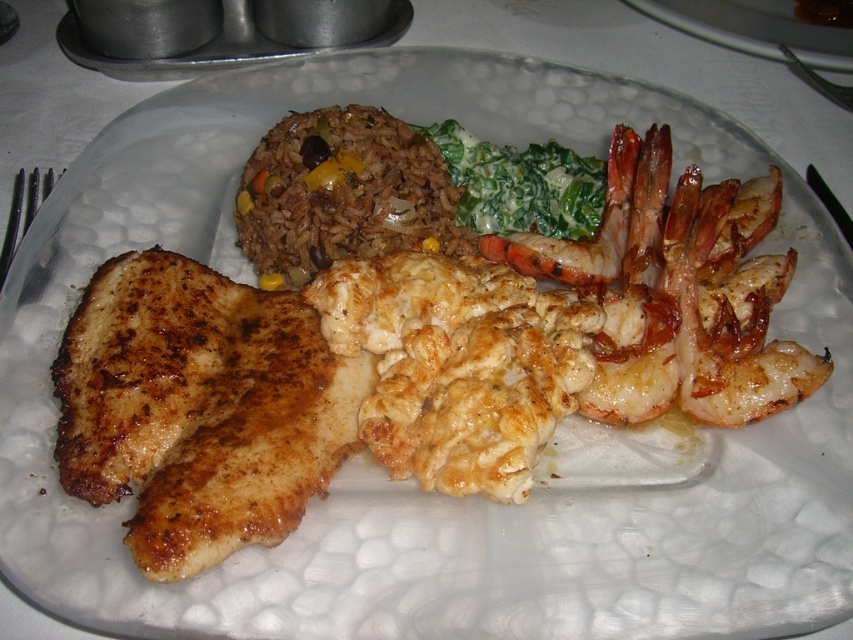
Question: Which object is the closest to the brown rice at center?

Choices:
 (A) shiny golden shrimp at upper right
 (B) green creamy spinach at upper center

Answer: (B)

Question: Which of the following is the farthest from the observer?

Choices:
 (A) shiny golden shrimp at upper right
 (B) brown rice at center
 (C) green creamy spinach at upper center

Answer: (C)

Question: Which is nearer to the green creamy spinach at upper center?

Choices:
 (A) brown rice at center
 (B) shiny golden shrimp at upper right

Answer: (B)

Question: Is brown rice at center closer to the viewer compared to green creamy spinach at upper center?

Choices:
 (A) no
 (B) yes

Answer: (B)

Question: Can you confirm if brown rice at center is smaller than shiny golden shrimp at upper right?

Choices:
 (A) yes
 (B) no

Answer: (B)

Question: Does brown rice at center come behind green creamy spinach at upper center?

Choices:
 (A) yes
 (B) no

Answer: (B)